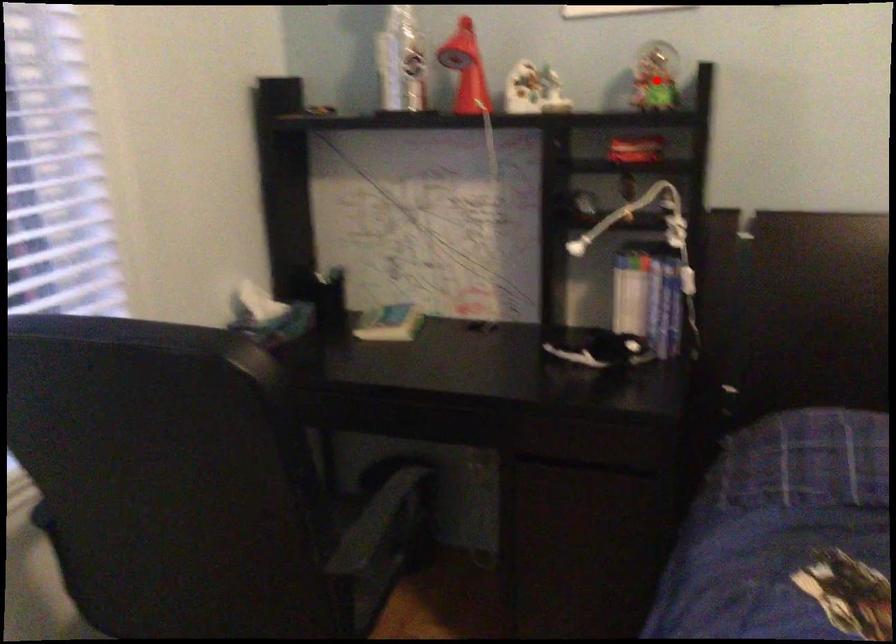
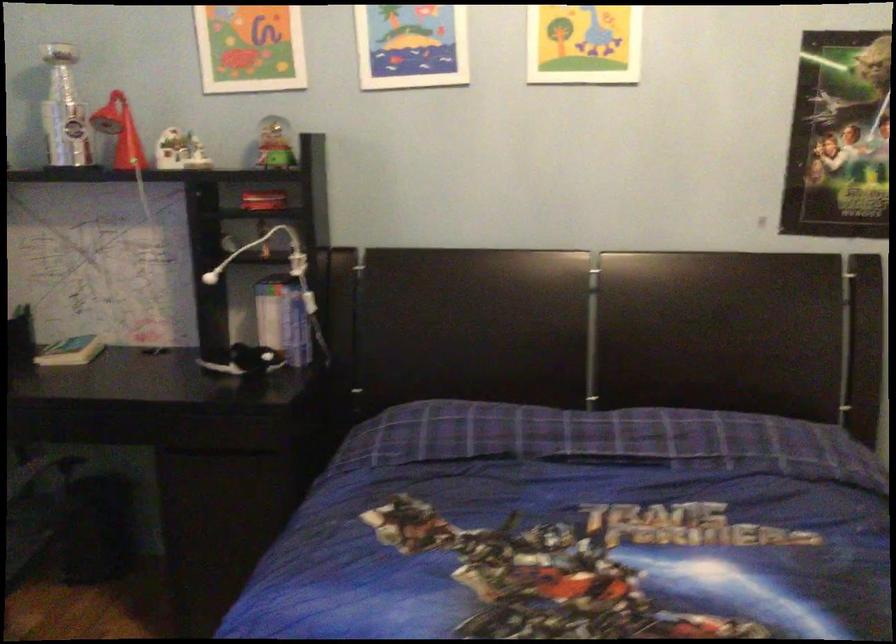
The point at the highlighted location is marked in the first image. Where is the corresponding point in the second image?

(273, 144)